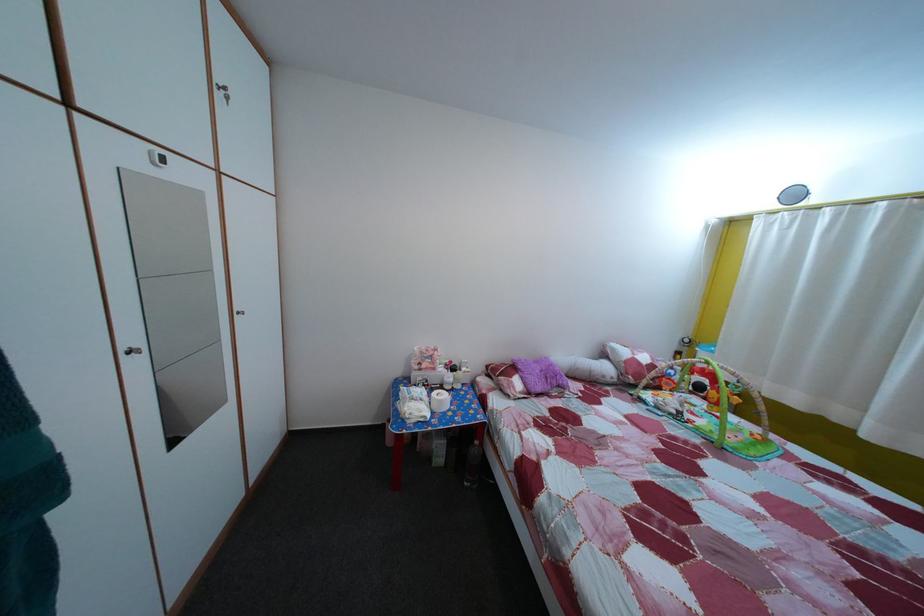
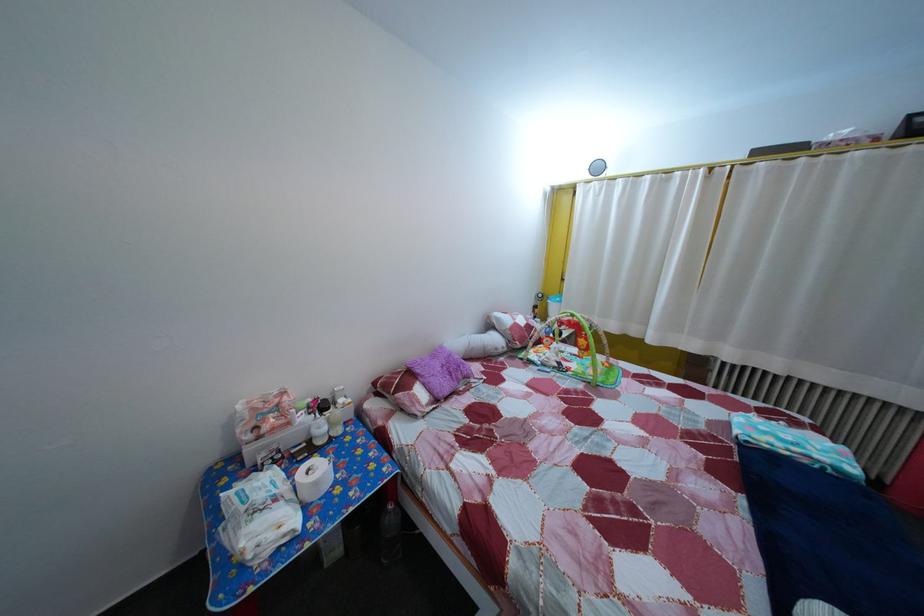
Locate, in the second image, the point that corresponds to (615,377) in the first image.

(505, 347)